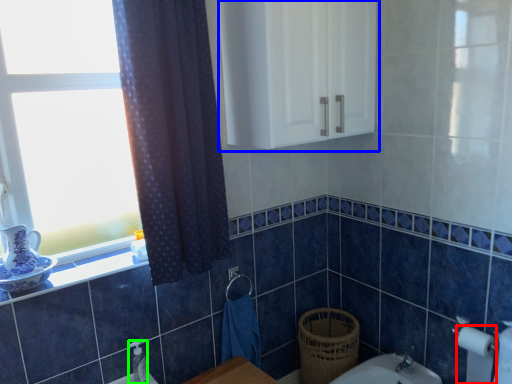
Question: Which is farther away from toilet paper (highlighted by a red box)? medicine cabinet (highlighted by a blue box) or toiletry (highlighted by a green box)?

Choices:
 (A) medicine cabinet
 (B) toiletry

Answer: (B)